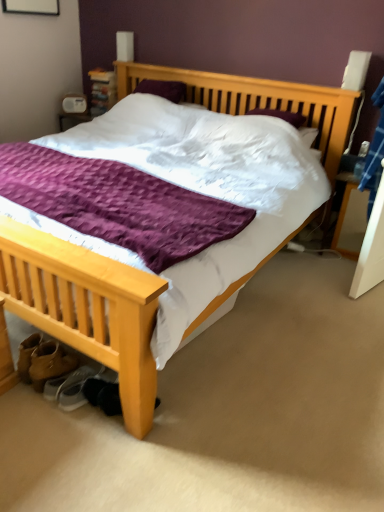
This screenshot has height=512, width=384. Describe the element at coordinates (65, 382) in the screenshot. I see `white fabric shoe at lower left, arranged as the 2th shoe when viewed from the right` at that location.

Describe the element at coordinates (103, 395) in the screenshot. I see `black suede shoe at lower left, which is the 1th shoe from right to left` at that location.

This screenshot has height=512, width=384. In order to click on light wood bed at center in this screenshot , I will do `click(87, 312)`.

Visually, is leather tan boot at lower left positioned to the left or to the right of light wood bed at center?

Clearly, leather tan boot at lower left is on the left of light wood bed at center in the image.

Is point (41, 381) farther from camera compared to point (325, 139)?

No, it is in front of (325, 139).

I want to click on bed located above the leather tan boot at lower left (from a real-world perspective), so click(87, 312).

Is leather tan boot at lower left placed right next to light wood bed at center?

leather tan boot at lower left and light wood bed at center are not in contact.

Is black suede shoe at lower left, which is the 1th shoe from right to left, located within leather tan boot at lower left?

Definitely not — black suede shoe at lower left, which is the 1th shoe from right to left, is not inside leather tan boot at lower left.

Which of these two, leather tan boot at lower left or black suede shoe at lower left, which appears as the second shoe when viewed from the left, stands taller?

leather tan boot at lower left is taller.

Is point (69, 364) more distant than point (89, 400)?

That is True.

Does white fabric shoe at lower left, which ranks as the 1th shoe in left-to-right order, have a larger size compared to leather tan boot at lower left?

Actually, white fabric shoe at lower left, which ranks as the 1th shoe in left-to-right order, might be smaller than leather tan boot at lower left.

Does point (83, 379) come in front of point (29, 372)?

Yes, point (83, 379) is closer to viewer.

Based on the photo, in the image, is white fabric shoe at lower left, arranged as the 2th shoe when viewed from the right, on the left side or the right side of leather tan boot at lower left?

white fabric shoe at lower left, arranged as the 2th shoe when viewed from the right, is to the right of leather tan boot at lower left.

From the picture: Is white fabric shoe at lower left, arranged as the 2th shoe when viewed from the right, far away from leather tan boot at lower left?

white fabric shoe at lower left, arranged as the 2th shoe when viewed from the right, is actually quite close to leather tan boot at lower left.

Is wooden nightstand at right at the back of white fabric shoe at lower left, which ranks as the 1th shoe in left-to-right order?

That's not correct — white fabric shoe at lower left, which ranks as the 1th shoe in left-to-right order, is not looking away from wooden nightstand at right.

Would you say white fabric shoe at lower left, which ranks as the 1th shoe in left-to-right order, contains wooden nightstand at right?

No, wooden nightstand at right is not surrounded by white fabric shoe at lower left, which ranks as the 1th shoe in left-to-right order.

From a real-world perspective, is white fabric shoe at lower left, which ranks as the 1th shoe in left-to-right order, on top of wooden nightstand at right?

No, from a real-world perspective, white fabric shoe at lower left, which ranks as the 1th shoe in left-to-right order, is not on top of wooden nightstand at right.

Considering the relative sizes of light wood bed at center and white fabric shoe at lower left, arranged as the 2th shoe when viewed from the right, in the image provided, is light wood bed at center thinner than white fabric shoe at lower left, arranged as the 2th shoe when viewed from the right,?

→ In fact, light wood bed at center might be wider than white fabric shoe at lower left, arranged as the 2th shoe when viewed from the right.

Consider the image. Can white fabric shoe at lower left, which ranks as the 1th shoe in left-to-right order, be found inside light wood bed at center?

Yes.

Measure the distance from light wood bed at center to white fabric shoe at lower left, arranged as the 2th shoe when viewed from the right.

They are 6.95 feet apart.

From the image's perspective, is light wood bed at center above or below white fabric shoe at lower left, arranged as the 2th shoe when viewed from the right?

light wood bed at center is situated higher than white fabric shoe at lower left, arranged as the 2th shoe when viewed from the right, in the image.

Are black suede shoe at lower left, which appears as the second shoe when viewed from the left, and white fabric shoe at lower left, arranged as the 2th shoe when viewed from the right, far apart?

No, black suede shoe at lower left, which appears as the second shoe when viewed from the left, is in close proximity to white fabric shoe at lower left, arranged as the 2th shoe when viewed from the right.

This screenshot has width=384, height=512. In order to click on shoe that is under the black suede shoe at lower left, which is the 1th shoe from right to left (from a real-world perspective) in this screenshot , I will do `click(65, 382)`.

Is black suede shoe at lower left, which is the 1th shoe from right to left, completely or partially outside of white fabric shoe at lower left, which ranks as the 1th shoe in left-to-right order?

Yes, black suede shoe at lower left, which is the 1th shoe from right to left, is outside of white fabric shoe at lower left, which ranks as the 1th shoe in left-to-right order.

From a real-world perspective, is wooden nightstand at right physically located above or below leather tan boot at lower left?

From a real-world perspective, wooden nightstand at right is physically above leather tan boot at lower left.

Does wooden nightstand at right have a larger size compared to leather tan boot at lower left?

Yes, wooden nightstand at right is bigger than leather tan boot at lower left.

Does wooden nightstand at right have a greater height compared to leather tan boot at lower left?

Indeed, wooden nightstand at right has a greater height compared to leather tan boot at lower left.

How different are the orientations of wooden nightstand at right and leather tan boot at lower left in degrees?

The facing directions of wooden nightstand at right and leather tan boot at lower left are 177 degrees apart.

I want to click on footwear lying on the left of light wood bed at center, so click(50, 362).

Starting from the leather tan boot at lower left, which shoe is the 2nd one to the right? Please provide its 2D coordinates.

[(103, 395)]

Considering their positions, is white fabric shoe at lower left, arranged as the 2th shoe when viewed from the right, positioned closer to light wood bed at center than wooden nightstand at right?

Among the two, wooden nightstand at right is located nearer to light wood bed at center.

From the image, which object appears to be nearer to wooden nightstand at right, leather tan boot at lower left or black suede shoe at lower left, which is the 1th shoe from right to left?

black suede shoe at lower left, which is the 1th shoe from right to left, is positioned closer to the anchor wooden nightstand at right.

Estimate the real-world distances between objects in this image. Which object is closer to light wood bed at center, black suede shoe at lower left, which appears as the second shoe when viewed from the left, or leather tan boot at lower left?

leather tan boot at lower left is closer to light wood bed at center.

Looking at the image, which one is located further to light wood bed at center, white fabric shoe at lower left, arranged as the 2th shoe when viewed from the right, or leather tan boot at lower left?

The object further to light wood bed at center is white fabric shoe at lower left, arranged as the 2th shoe when viewed from the right.

Based on their spatial positions, is white fabric shoe at lower left, which ranks as the 1th shoe in left-to-right order, or black suede shoe at lower left, which appears as the second shoe when viewed from the left, closer to wooden nightstand at right?

white fabric shoe at lower left, which ranks as the 1th shoe in left-to-right order, is closer to wooden nightstand at right.

Looking at the image, which one is located closer to white fabric shoe at lower left, which ranks as the 1th shoe in left-to-right order, wooden nightstand at right or black suede shoe at lower left, which appears as the second shoe when viewed from the left?

black suede shoe at lower left, which appears as the second shoe when viewed from the left, is closer to white fabric shoe at lower left, which ranks as the 1th shoe in left-to-right order.

In the scene shown: Based on their spatial positions, is white fabric shoe at lower left, which ranks as the 1th shoe in left-to-right order, or leather tan boot at lower left closer to black suede shoe at lower left, which is the 1th shoe from right to left?

white fabric shoe at lower left, which ranks as the 1th shoe in left-to-right order.

Estimate the real-world distances between objects in this image. Which object is further from white fabric shoe at lower left, which ranks as the 1th shoe in left-to-right order, light wood bed at center or wooden nightstand at right?

light wood bed at center.

Locate an element on the screen. The width and height of the screenshot is (384, 512). bed between white fabric shoe at lower left, which ranks as the 1th shoe in left-to-right order, and wooden nightstand at right from left to right is located at coordinates (87, 312).

You are a GUI agent. You are given a task and a screenshot of the screen. Output one action in this format:
    pyautogui.click(x=<x>, y=<y>)
    Task: Click on the bed between leather tan boot at lower left and wooden nightstand at right from left to right
    This screenshot has width=384, height=512.
    Given the screenshot: What is the action you would take?
    pyautogui.click(x=87, y=312)

Find the location of a particular element. The width and height of the screenshot is (384, 512). shoe situated between leather tan boot at lower left and black suede shoe at lower left, which appears as the second shoe when viewed from the left, from left to right is located at coordinates (65, 382).

In order to click on footwear between light wood bed at center and white fabric shoe at lower left, arranged as the 2th shoe when viewed from the right, vertically in this screenshot , I will do `click(50, 362)`.